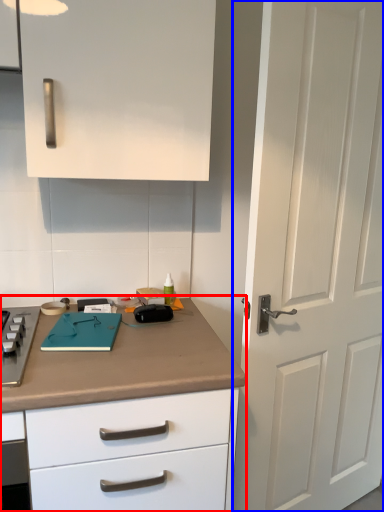
Question: Which object is closer to the camera taking this photo, countertop (highlighted by a red box) or door (highlighted by a blue box)?

Choices:
 (A) countertop
 (B) door

Answer: (A)